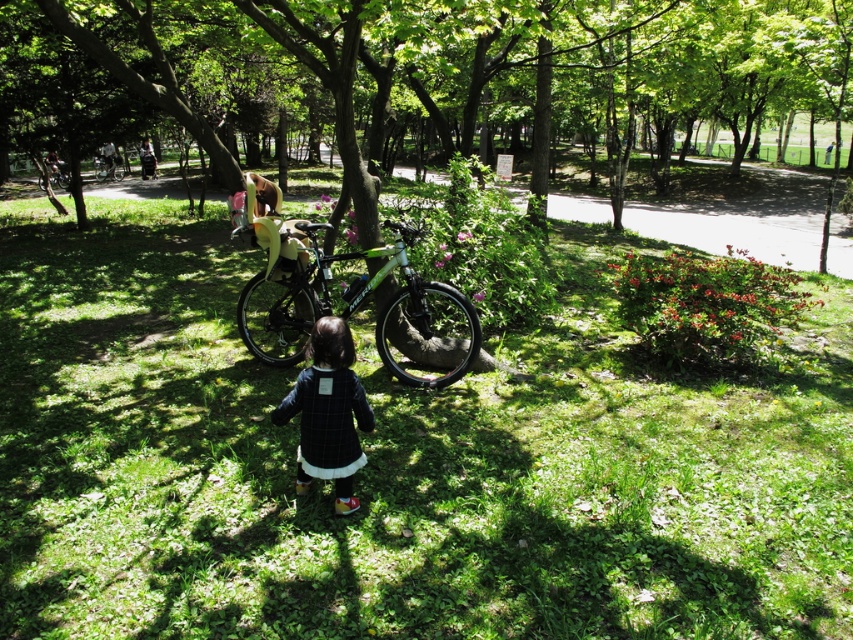
The image size is (853, 640). Describe the element at coordinates (395, 465) in the screenshot. I see `green grass at center` at that location.

Who is more distant from viewer, (506, 448) or (198, 45)?

The point (198, 45) is more distant.

Locate an element on the screen. This screenshot has height=640, width=853. green grass at center is located at coordinates (395, 465).

Can you confirm if green matte tree at center is positioned below green matte bicycle at upper center?

Actually, green matte tree at center is above green matte bicycle at upper center.

Image resolution: width=853 pixels, height=640 pixels. Describe the element at coordinates (426, 77) in the screenshot. I see `green matte tree at center` at that location.

Describe the element at coordinates (426, 77) in the screenshot. I see `green matte tree at center` at that location.

At what (x,y) coordinates should I click in order to perform the action: click on green matte tree at center. Please return your answer as a coordinate pair (x, y). Looking at the image, I should click on (426, 77).

Is green matte bicycle at upper center below green matte bicycle at upper left?

Actually, green matte bicycle at upper center is above green matte bicycle at upper left.

This screenshot has height=640, width=853. Identify the location of green matte bicycle at upper center. (108, 166).

Which is in front, point (112, 172) or point (67, 173)?

Point (67, 173)

Where is `green matte bicycle at upper center`? The image size is (853, 640). green matte bicycle at upper center is located at coordinates (108, 166).